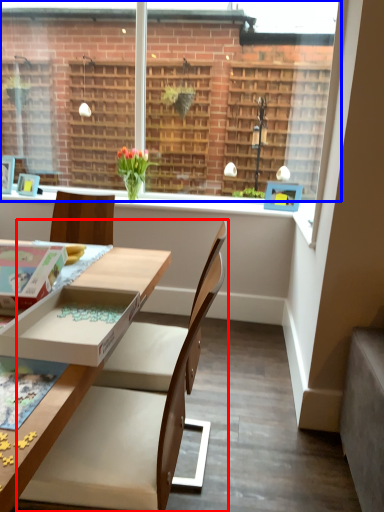
Question: Which of the following is the farthest to the observer, chair (highlighted by a red box) or window (highlighted by a blue box)?

Choices:
 (A) chair
 (B) window

Answer: (B)